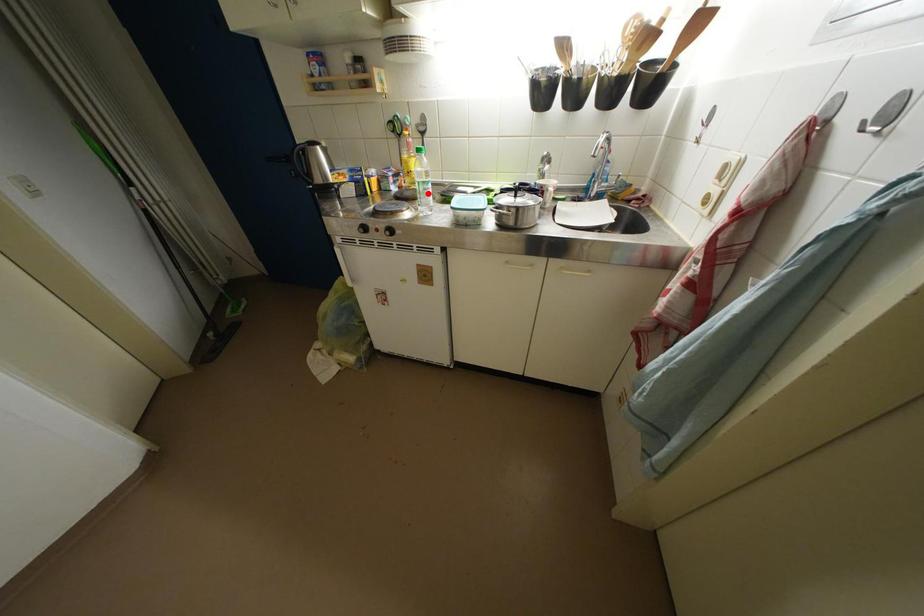
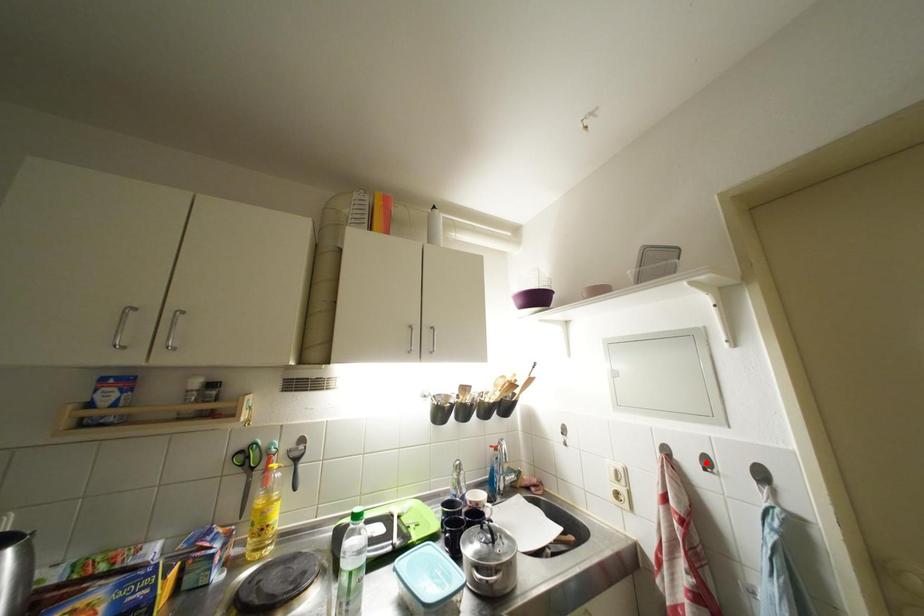
I am providing you with two images of the same scene from different viewpoints. A red point is marked on the first image and another point is marked on the second image. Do the highlighted points in image1 and image2 indicate the same real-world spot?

No